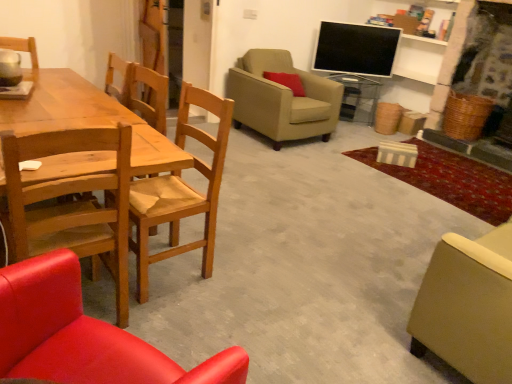
Describe the element at coordinates (468, 306) in the screenshot. Image resolution: width=512 pixels, height=384 pixels. I see `matte beige armchair at lower right, the third chair viewed from the back` at that location.

Image resolution: width=512 pixels, height=384 pixels. I want to click on transparent glass side table at center, so click(357, 94).

What is the approximate width of matte red pillow at upper center?

The width of matte red pillow at upper center is 7.99 inches.

What do you see at coordinates (356, 49) in the screenshot? This screenshot has width=512, height=384. I see `flat screen tv at upper right` at bounding box center [356, 49].

Locate an element on the screen. matte beige armchair at lower right, the third chair viewed from the back is located at coordinates (468, 306).

Can you tell me how much flat screen tv at upper right and matte beige armchair at lower right, the third chair viewed from the back, differ in facing direction?

142 degrees.

Which is correct: flat screen tv at upper right is inside matte beige armchair at lower right, the third chair viewed from the back, or outside of it?

flat screen tv at upper right cannot be found inside matte beige armchair at lower right, the third chair viewed from the back.

From the picture: Which object is wider, flat screen tv at upper right or matte beige armchair at lower right, the third chair viewed from the back?

matte beige armchair at lower right, the third chair viewed from the back, is wider.

Based on the photo, is flat screen tv at upper right not near matte beige armchair at lower right, acting as the third chair starting from the front?

Yes, flat screen tv at upper right and matte beige armchair at lower right, acting as the third chair starting from the front, are located far from each other.

What's the angular difference between transparent glass side table at center and wooden chair at left, the fourth chair viewed from the back,'s facing directions?

transparent glass side table at center and wooden chair at left, the fourth chair viewed from the back, are facing 145 degrees away from each other.

Who is bigger, transparent glass side table at center or wooden chair at left, the second chair viewed from the front?

With larger size is wooden chair at left, the second chair viewed from the front.

Which object is positioned more to the left, transparent glass side table at center or wooden chair at left, the fourth chair viewed from the back?

wooden chair at left, the fourth chair viewed from the back, is more to the left.

From a real-world perspective, is transparent glass side table at center positioned above or below wooden chair at left, the second chair viewed from the front?

transparent glass side table at center is situated lower than wooden chair at left, the second chair viewed from the front, in the real world.

How many degrees apart are the facing directions of transparent glass side table at center and matte wood chair at lower left, which is the fifth chair from back to front?

The facing directions of transparent glass side table at center and matte wood chair at lower left, which is the fifth chair from back to front, are 147 degrees apart.

From the picture: Is transparent glass side table at center positioned with its back to matte wood chair at lower left, which is the fifth chair from back to front?

No, transparent glass side table at center's orientation is not away from matte wood chair at lower left, which is the fifth chair from back to front.

Would you say transparent glass side table at center is outside matte wood chair at lower left, the 1th chair in the front-to-back sequence?

Indeed, transparent glass side table at center is completely outside matte wood chair at lower left, the 1th chair in the front-to-back sequence.

Which of these two, transparent glass side table at center or matte wood chair at lower left, which is the fifth chair from back to front, stands shorter?

transparent glass side table at center is shorter.

Based on the photo, is matte red pillow at upper center aimed at matte wood chair at lower left, which is the fifth chair from back to front?

No, matte red pillow at upper center is not turned towards matte wood chair at lower left, which is the fifth chair from back to front.

Is matte red pillow at upper center next to matte wood chair at lower left, the 1th chair in the front-to-back sequence?

No, matte red pillow at upper center is not with matte wood chair at lower left, the 1th chair in the front-to-back sequence.

Between matte red pillow at upper center and matte wood chair at lower left, the 1th chair in the front-to-back sequence, which one has smaller size?

matte red pillow at upper center is smaller.

Is point (281, 81) positioned behind point (61, 254)?

Yes.

Who is taller, matte beige armchair at lower right, the third chair viewed from the back, or matte red pillow at upper center?

With more height is matte beige armchair at lower right, the third chair viewed from the back.

Which is in front, point (422, 285) or point (291, 77)?

Point (422, 285)

From a real-world perspective, is matte beige armchair at lower right, the third chair viewed from the back, over matte red pillow at upper center?

No.

The image size is (512, 384). There is a wooden chair at left, the second chair viewed from the front. Find the location of `the 1st chair below it (from the image's perspective)`. the 1st chair below it (from the image's perspective) is located at coordinates (468, 306).

How distant is wooden chair at left, the second chair viewed from the front, from matte beige armchair at lower right, the third chair viewed from the back?

wooden chair at left, the second chair viewed from the front, is 1.34 meters from matte beige armchair at lower right, the third chair viewed from the back.

Who is more distant, wooden chair at left, the second chair viewed from the front, or matte beige armchair at lower right, the third chair viewed from the back?

matte beige armchair at lower right, the third chair viewed from the back, is more distant.

Is wooden chair at left, the second chair viewed from the front, completely or partially outside of matte beige armchair at lower right, the third chair viewed from the back?

Yes, wooden chair at left, the second chair viewed from the front, is located beyond the bounds of matte beige armchair at lower right, the third chair viewed from the back.

Is matte beige armchair at lower right, the third chair viewed from the back, not inside matte wood chair at lower left, the 1th chair in the front-to-back sequence?

Absolutely, matte beige armchair at lower right, the third chair viewed from the back, is external to matte wood chair at lower left, the 1th chair in the front-to-back sequence.

Is matte beige armchair at lower right, the third chair viewed from the back, oriented towards matte wood chair at lower left, which is the fifth chair from back to front?

No, matte beige armchair at lower right, the third chair viewed from the back, is not facing towards matte wood chair at lower left, which is the fifth chair from back to front.

Considering the relative sizes of matte beige armchair at lower right, the third chair viewed from the back, and matte wood chair at lower left, which is the fifth chair from back to front, in the image provided, is matte beige armchair at lower right, the third chair viewed from the back, shorter than matte wood chair at lower left, which is the fifth chair from back to front,?

Incorrect, the height of matte beige armchair at lower right, the third chair viewed from the back, does not fall short of that of matte wood chair at lower left, which is the fifth chair from back to front.

Between matte beige armchair at lower right, acting as the third chair starting from the front, and matte wood chair at lower left, the 1th chair in the front-to-back sequence, which one has smaller width?

matte wood chair at lower left, the 1th chair in the front-to-back sequence.

This screenshot has width=512, height=384. In order to click on chair lying on the right of flat screen tv at upper right in this screenshot , I will do `click(468, 306)`.

The height and width of the screenshot is (384, 512). What are the coordinates of `the 4th chair in front of the transparent glass side table at center` in the screenshot? It's located at (72, 203).

From the picture: Based on their spatial positions, is beige fabric armchair at center, which is counted as the 5th chair, starting from the front, or matte beige armchair at lower right, the third chair viewed from the back, further from flat screen tv at upper right?

matte beige armchair at lower right, the third chair viewed from the back.

Which object lies further to the anchor point wooden chair at left, which is counted as the fourth chair, starting from the front, matte wood chair at lower left, the 1th chair in the front-to-back sequence, or flat screen tv at upper right?

flat screen tv at upper right is positioned further to the anchor wooden chair at left, which is counted as the fourth chair, starting from the front.

Estimate the real-world distances between objects in this image. Which object is closer to transparent glass side table at center, matte beige armchair at lower right, the third chair viewed from the back, or matte wood chair at lower left, the 1th chair in the front-to-back sequence?

matte beige armchair at lower right, the third chair viewed from the back, is positioned closer to the anchor transparent glass side table at center.

Based on their spatial positions, is matte wood chair at lower left, the 1th chair in the front-to-back sequence, or transparent glass side table at center closer to wooden chair at left, the fourth chair viewed from the back?

matte wood chair at lower left, the 1th chair in the front-to-back sequence, is positioned closer to the anchor wooden chair at left, the fourth chair viewed from the back.

Considering their positions, is matte wood chair at lower left, which is the fifth chair from back to front, positioned further to wooden chair at left, which appears as the second chair when viewed from the back, than beige fabric armchair at center, which is counted as the 5th chair, starting from the front?

beige fabric armchair at center, which is counted as the 5th chair, starting from the front, is further to wooden chair at left, which appears as the second chair when viewed from the back.

Based on their spatial positions, is matte wood chair at lower left, the 1th chair in the front-to-back sequence, or transparent glass side table at center further from beige fabric armchair at center, which is counted as the 5th chair, starting from the front?

matte wood chair at lower left, the 1th chair in the front-to-back sequence.

Looking at the image, which one is located closer to matte beige armchair at lower right, acting as the third chair starting from the front, beige fabric armchair at center, acting as the 1th chair starting from the back, or matte red pillow at upper center?

Among the two, beige fabric armchair at center, acting as the 1th chair starting from the back, is located nearer to matte beige armchair at lower right, acting as the third chair starting from the front.

When comparing their distances from wooden chair at left, the fourth chair viewed from the back, does matte wood chair at lower left, the 1th chair in the front-to-back sequence, or beige fabric armchair at center, acting as the 1th chair starting from the back, seem closer?

The object closer to wooden chair at left, the fourth chair viewed from the back, is matte wood chair at lower left, the 1th chair in the front-to-back sequence.

Locate an element on the screen. This screenshot has width=512, height=384. television positioned between wooden chair at left, which is counted as the fourth chair, starting from the front, and transparent glass side table at center from near to far is located at coordinates (356, 49).

Where is `pillow located between beige fabric armchair at center, which is counted as the 5th chair, starting from the front, and transparent glass side table at center in the depth direction`? This screenshot has width=512, height=384. pillow located between beige fabric armchair at center, which is counted as the 5th chair, starting from the front, and transparent glass side table at center in the depth direction is located at coordinates (287, 81).

This screenshot has height=384, width=512. I want to click on pillow positioned between matte wood chair at lower left, which is the fifth chair from back to front, and transparent glass side table at center from near to far, so click(287, 81).

You are a GUI agent. You are given a task and a screenshot of the screen. Output one action in this format:
    pyautogui.click(x=<x>, y=<y>)
    Task: Click on the television located between matte wood chair at lower left, the 1th chair in the front-to-back sequence, and transparent glass side table at center in the depth direction
    This screenshot has height=384, width=512.
    Given the screenshot: What is the action you would take?
    pyautogui.click(x=356, y=49)